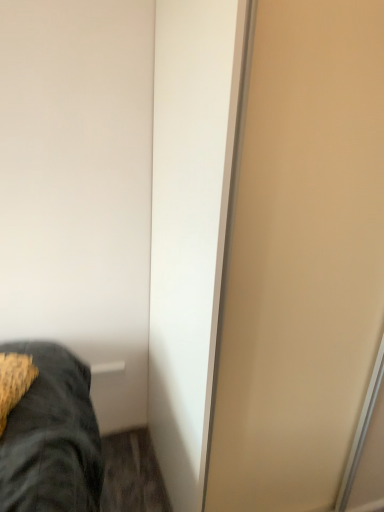
You are a GUI agent. You are given a task and a screenshot of the screen. Output one action in this format:
    pyautogui.click(x=<x>, y=<y>)
    Task: Click on the white matte screen door at center
    This screenshot has width=384, height=512.
    Given the screenshot: What is the action you would take?
    pyautogui.click(x=302, y=258)

Describe the element at coordinates (302, 258) in the screenshot. I see `white matte screen door at center` at that location.

In order to face white matte screen door at center, should I rotate leftwards or rightwards?

Turn right by 20.572 degrees to look at white matte screen door at center.

Find the location of a particular element. This screenshot has width=384, height=512. white matte screen door at center is located at coordinates (302, 258).